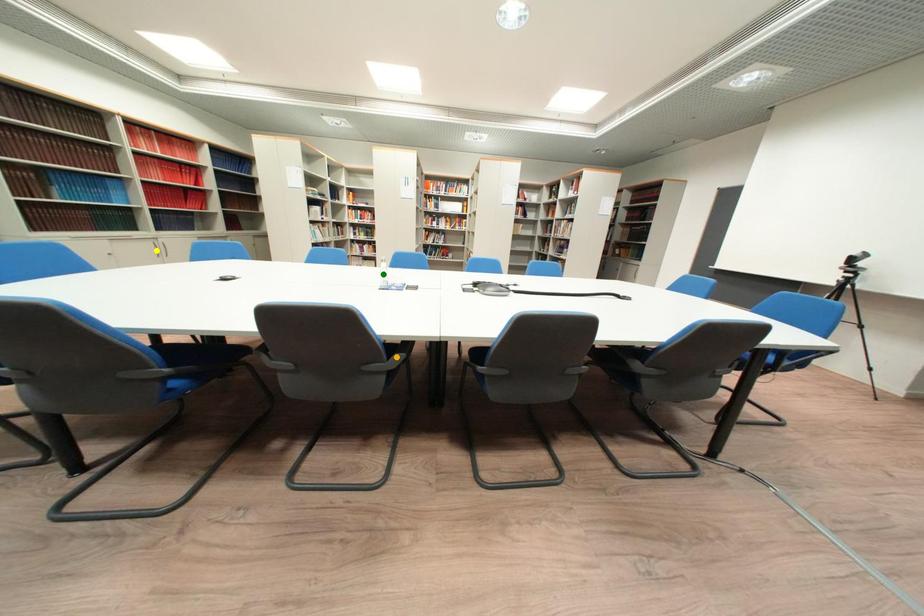
Order these from nearest to farthest:
A) orange point
B) yellow point
C) green point

orange point < green point < yellow point